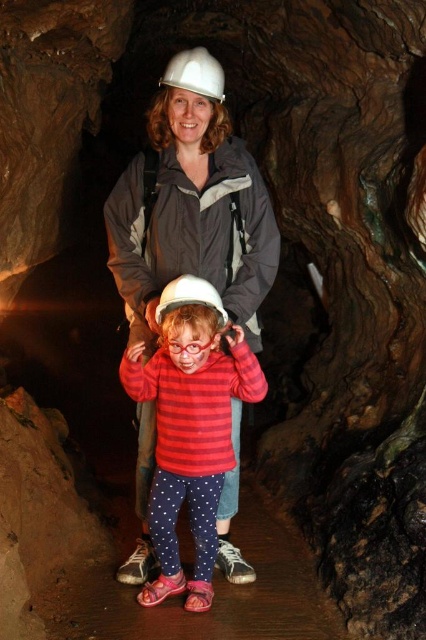
Between point (178, 76) and point (201, 296), which one is positioned behind?

Point (178, 76)

The width and height of the screenshot is (426, 640). Identify the location of white matte helmet at upper center. (195, 74).

Is point (215, 333) more distant than point (178, 300)?

That is True.

Is striped cotton shirt at center positioned behind white matte helmet at center?

No.

This screenshot has height=640, width=426. Describe the element at coordinates (189, 424) in the screenshot. I see `striped cotton shirt at center` at that location.

Locate an element on the screen. striped cotton shirt at center is located at coordinates (189, 424).

Which is more to the left, striped cotton shirt at center or white matte helmet at upper center?

From the viewer's perspective, striped cotton shirt at center appears more on the left side.

Is point (204, 356) farther from viewer compared to point (213, 74)?

No, (204, 356) is closer to viewer.

Find the location of a particular element. striped cotton shirt at center is located at coordinates (189, 424).

Identify the location of striped cotton shirt at center. (189, 424).